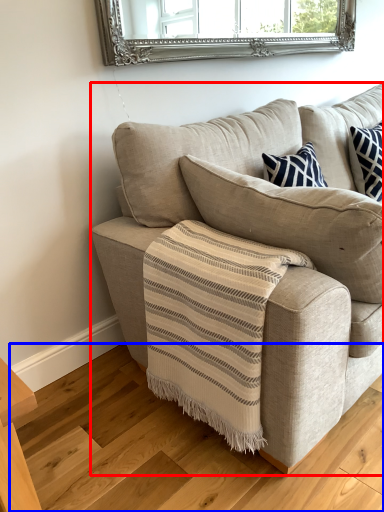
Question: Which point is further to the camera, studio couch (highlighted by a red box) or stair (highlighted by a blue box)?

Choices:
 (A) studio couch
 (B) stair

Answer: (A)